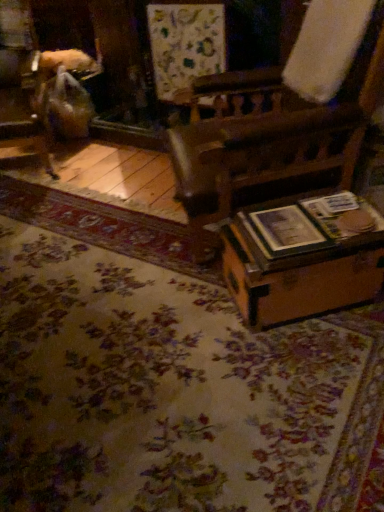
This screenshot has width=384, height=512. In order to click on vacant area in front of wooden trunk at lower right in this screenshot , I will do `click(308, 374)`.